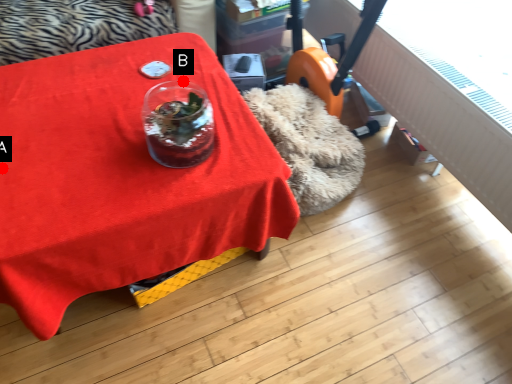
Question: Two points are circled on the image, labeled by A and B beside each circle. Among these points, which one is nearest to the camera?

Choices:
 (A) A is closer
 (B) B is closer

Answer: (A)